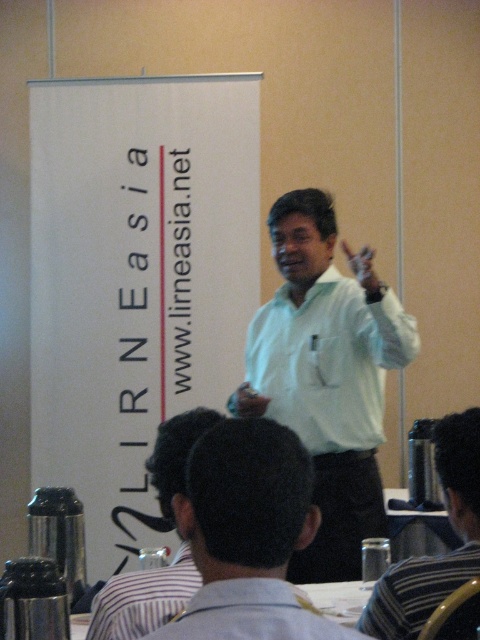
What is the 2D coordinate of the white shirt at center in the image?

The 2D coordinate of the white shirt at center is at point (248, 536).